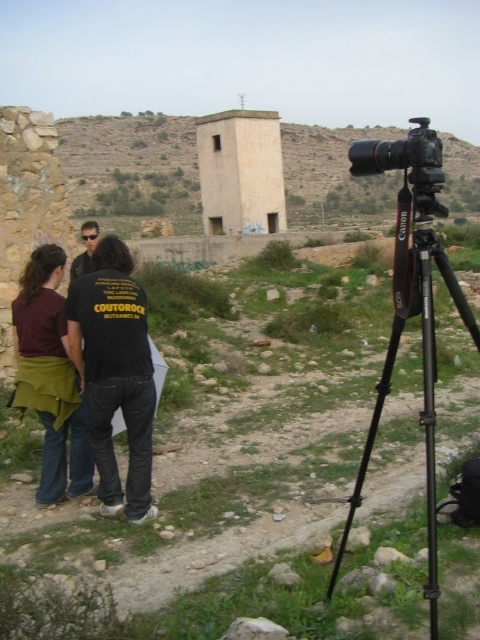
Can you confirm if brown rocky hill at upper center is bigger than black plastic camera at center?

Correct, brown rocky hill at upper center is larger in size than black plastic camera at center.

Is point (106, 200) less distant than point (420, 173)?

No.

Identify the location of brown rocky hill at upper center. (132, 168).

Does olive green fabric apron at center have a larger size compared to black plastic camera at center?

No.

Who is more forward, (39,308) or (405,152)?

Positioned in front is point (405,152).

The width and height of the screenshot is (480, 640). I want to click on olive green fabric apron at center, so click(49, 378).

Is brown rocky hill at upper center to the right of black metal tripod at right from the viewer's perspective?

Yes, brown rocky hill at upper center is to the right of black metal tripod at right.

I want to click on brown rocky hill at upper center, so click(x=132, y=168).

The image size is (480, 640). I want to click on brown rocky hill at upper center, so click(x=132, y=168).